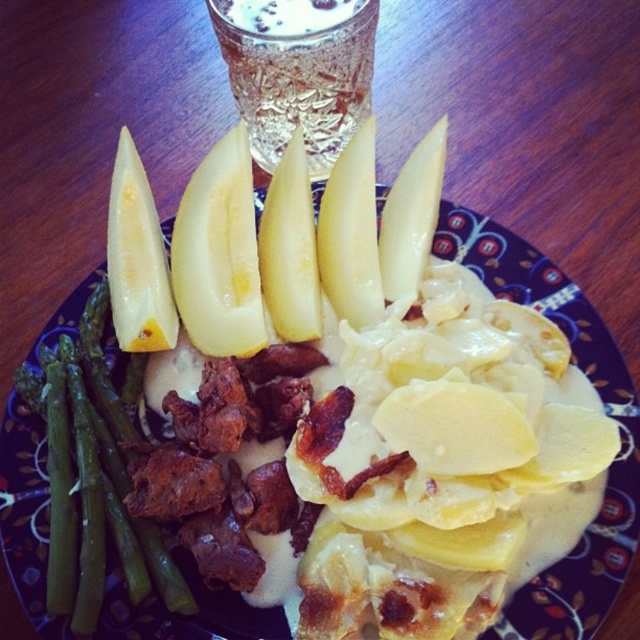
Which is more to the left, green smooth asparagus at left or yellow smooth apple at upper left?

From the viewer's perspective, green smooth asparagus at left appears more on the left side.

Who is more forward, [83,486] or [134,221]?

Positioned in front is point [83,486].

Find the location of a particular element. green smooth asparagus at left is located at coordinates (108, 472).

Which of these two, yellow matte potato at center or yellow smooth apple at upper left, stands taller?

With more height is yellow matte potato at center.

Does yellow matte potato at center appear under yellow smooth apple at upper left?

Correct, yellow matte potato at center is located below yellow smooth apple at upper left.

Between point (602, 522) and point (125, 260), which one is positioned in front?

Point (602, 522)

Where is `yellow matte potato at center`? yellow matte potato at center is located at coordinates (602, 397).

Is the position of yellow matte potato at center less distant than that of clear glass beverage at upper center?

Yes.

Can you confirm if yellow matte potato at center is smaller than clear glass beverage at upper center?

No, yellow matte potato at center is not smaller than clear glass beverage at upper center.

Which is behind, point (246, 634) or point (348, 3)?

The point (348, 3) is behind.

Where is `yellow matte potato at center`? yellow matte potato at center is located at coordinates (602, 397).